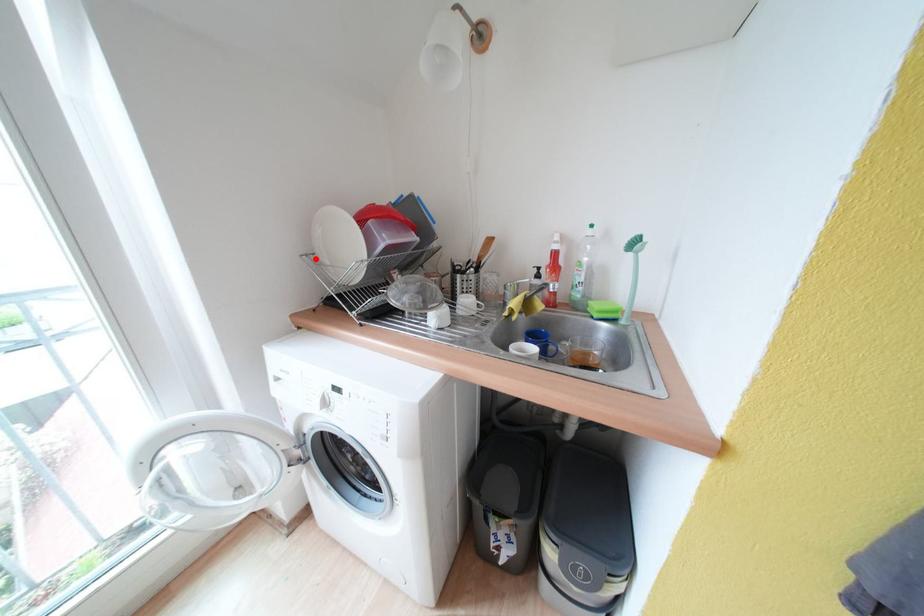
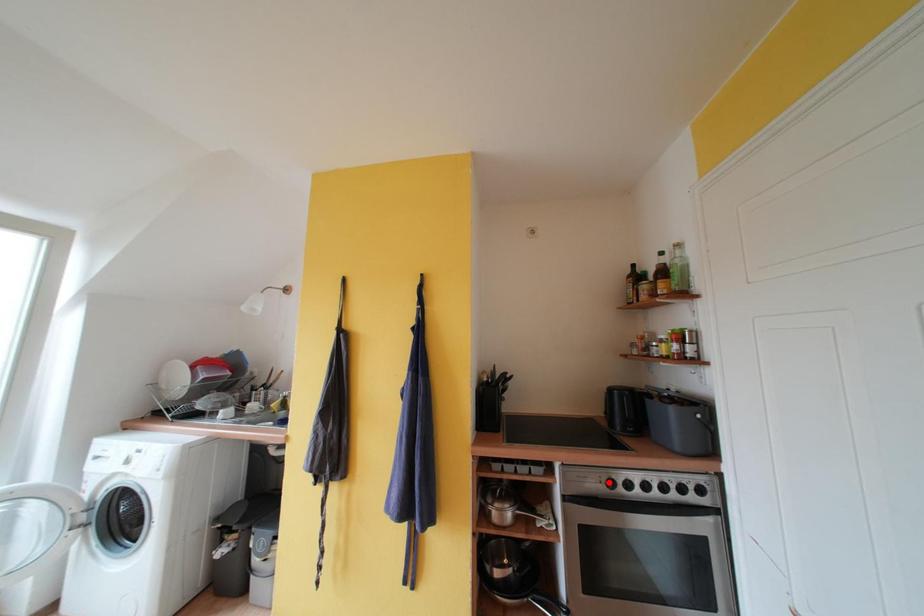
I am providing you with two images of the same scene from different viewpoints. A red point is marked on the first image and another point is marked on the second image. Do the highlighted points in image1 and image2 indicate the same real-world spot?

No